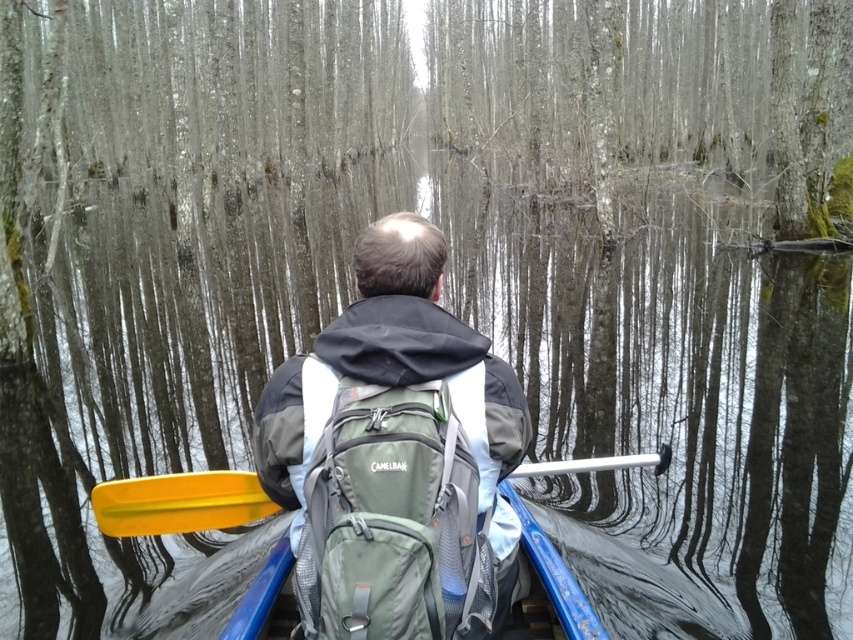
You are a photographer trying to capture the yellow plastic paddle at lower left in the image. The camera you are using has a rectangular viewfinder with coordinates from 0 to 1 on both axes. Where should you position the camera to ensure the paddle is centered in the viewfinder?

You should position the camera at coordinates approximately 0.786 on the x axis and 0.211 on the y axis to center the yellow plastic paddle at lower left in the viewfinder.

You are navigating a canoe through a flooded forest and need to secure your green fabric backpack at center. Where should you place it to ensure it stays centered in the canoe?

The green fabric backpack at center should be placed at the 2D location point (393, 522) to ensure it stays centered in the canoe.

You are a hiker who just arrived at a swampy area and need to decide whether to store your gear inside the canoe or keep it on your back. Based on the scene, which object is closer to you, the green fabric backpack at center or the blue plastic canoe at center?

The green fabric backpack at center is in front of the blue plastic canoe at center, so the backpack is closer to you.